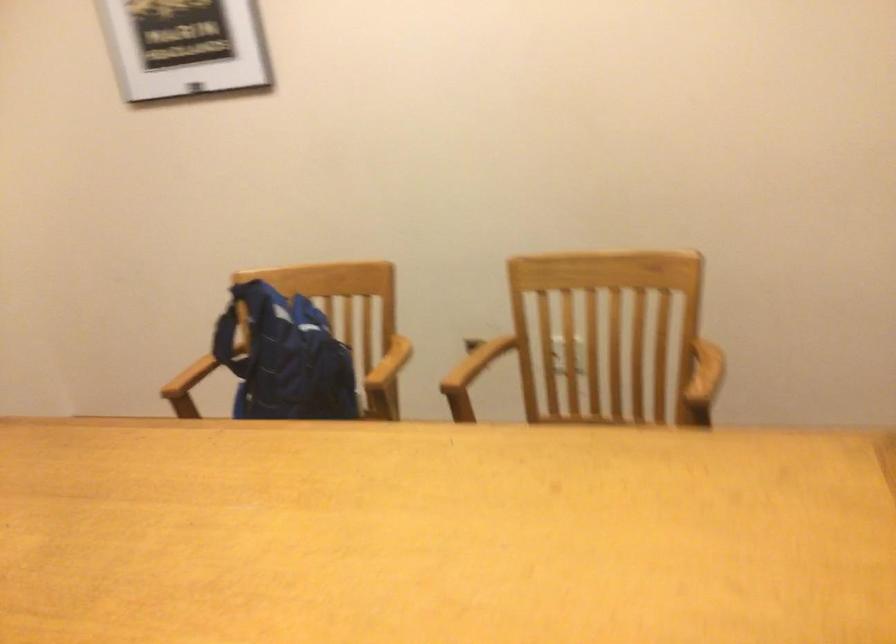
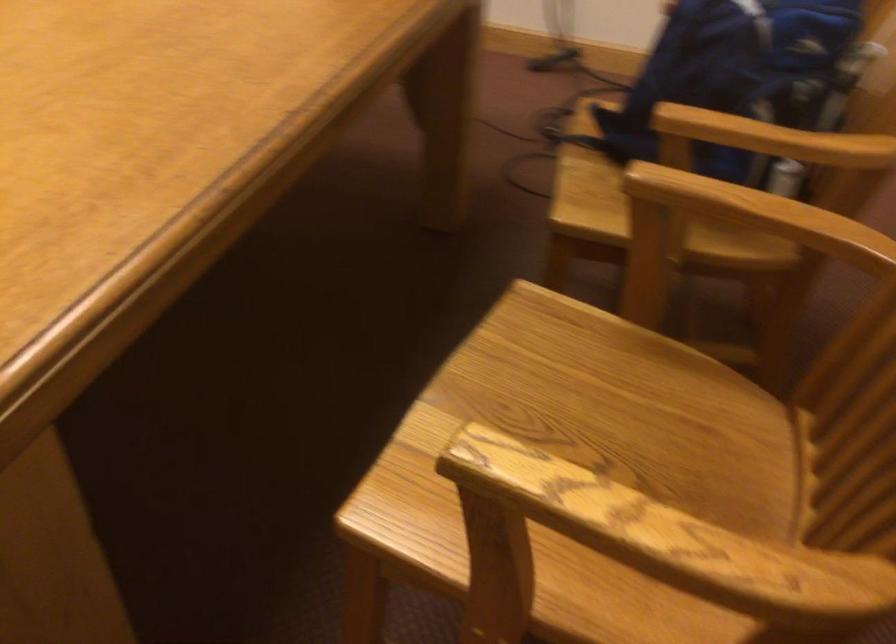
Find the pixel in the second image that matches point 471,371 in the first image.

(743, 223)